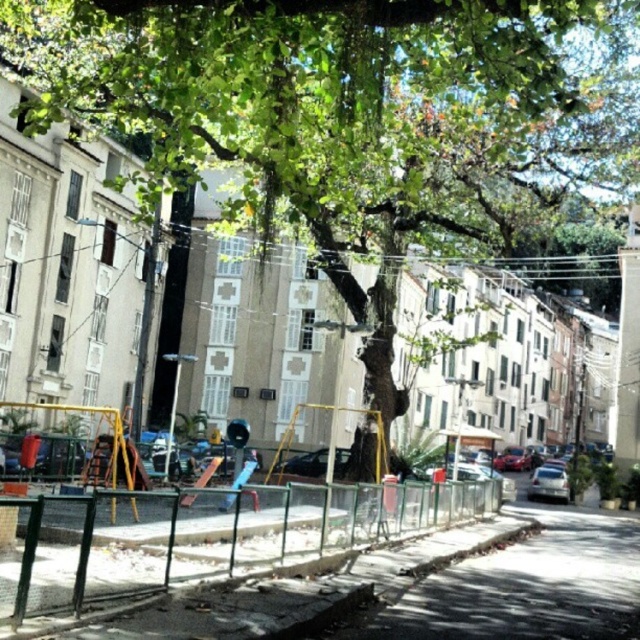
You are a delivery person who needs to park your silver metallic car at center on the gray concrete pavement at lower center. Can your car fit on the pavement without overhanging?

The gray concrete pavement at lower center is wider than the silver metallic car at center, so the car can fit on the pavement without overhanging.

You are a delivery person needing to park your metallic silver car at center close to the green metal fence at center. Can you fit the car between them without any adjustments?

The green metal fence at center has a larger size compared to metallic silver car at center, so there might not be enough space to fit the car between them without adjustments.